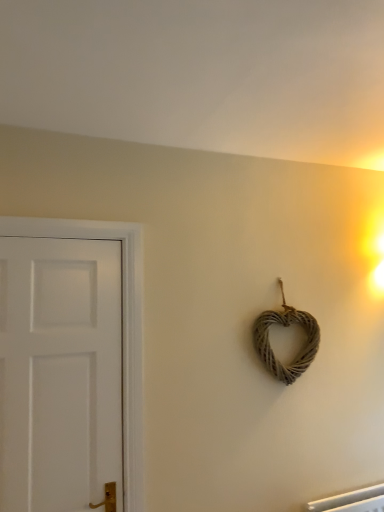
What do you see at coordinates (286, 326) in the screenshot? I see `woven natural heart at center-right` at bounding box center [286, 326].

This screenshot has height=512, width=384. In order to click on woven natural heart at center-right in this screenshot , I will do `click(286, 326)`.

Find the location of a particular element. white matte door at left is located at coordinates (60, 373).

Describe the element at coordinates (60, 373) in the screenshot. I see `white matte door at left` at that location.

At what (x,y) coordinates should I click in order to perform the action: click on woven natural heart at center-right. Please return your answer as a coordinate pair (x, y). Looking at the image, I should click on (286, 326).

Considering the relative positions of woven natural heart at center-right and white matte door at left in the image provided, is woven natural heart at center-right to the right of white matte door at left from the viewer's perspective?

Correct, you'll find woven natural heart at center-right to the right of white matte door at left.

Which object is more forward, woven natural heart at center-right or white matte door at left?

white matte door at left.

Does point (306, 345) come in front of point (16, 338)?

No.

From the image's perspective, is woven natural heart at center-right located above or below white matte door at left?

woven natural heart at center-right is above white matte door at left.

From a real-world perspective, which is physically below, woven natural heart at center-right or white matte door at left?

white matte door at left, from a real-world perspective.

Based on the photo, which of these two, woven natural heart at center-right or white matte door at left, is thinner?

white matte door at left.

Who is taller, woven natural heart at center-right or white matte door at left?

white matte door at left.

Is woven natural heart at center-right bigger or smaller than white matte door at left?

Clearly, woven natural heart at center-right is smaller in size than white matte door at left.

Is woven natural heart at center-right spatially inside white matte door at left, or outside of it?

woven natural heart at center-right is not inside white matte door at left, it's outside.

Is there a large distance between woven natural heart at center-right and white matte door at left?

Actually, woven natural heart at center-right and white matte door at left are a little close together.

Is woven natural heart at center-right oriented away from white matte door at left?

No, white matte door at left is not at the back of woven natural heart at center-right.

How different are the orientations of woven natural heart at center-right and white matte door at left in degrees?

They differ by 0.00972 degrees in their facing directions.

Locate an element on the screen. The image size is (384, 512). door on the left of woven natural heart at center-right is located at coordinates (60, 373).

Can you confirm if white matte door at left is positioned to the right of woven natural heart at center-right?

No, white matte door at left is not to the right of woven natural heart at center-right.

Is white matte door at left closer to camera compared to woven natural heart at center-right?

Yes, white matte door at left is closer to the camera.

Considering the points (106, 318) and (281, 377), which point is in front, point (106, 318) or point (281, 377)?

The point (106, 318) is in front.

From the image's perspective, which is below, white matte door at left or woven natural heart at center-right?

white matte door at left.

From a real-world perspective, is white matte door at left positioned over woven natural heart at center-right based on gravity?

No.

Based on the photo, considering the sizes of objects white matte door at left and woven natural heart at center-right in the image provided, who is thinner, white matte door at left or woven natural heart at center-right?

Thinner between the two is white matte door at left.

Does white matte door at left have a lesser height compared to woven natural heart at center-right?

Incorrect, the height of white matte door at left does not fall short of that of woven natural heart at center-right.

Which of these two, white matte door at left or woven natural heart at center-right, is bigger?

white matte door at left is bigger.

Is white matte door at left located outside woven natural heart at center-right?

Yes, white matte door at left is located beyond the bounds of woven natural heart at center-right.

Is white matte door at left far away from woven natural heart at center-right?

No, there isn't a large distance between white matte door at left and woven natural heart at center-right.

Does white matte door at left turn towards woven natural heart at center-right?

No, white matte door at left is not oriented towards woven natural heart at center-right.

You are a GUI agent. You are given a task and a screenshot of the screen. Output one action in this format:
    pyautogui.click(x=<x>, y=<y>)
    Task: Click on the door on the left side of woven natural heart at center-right
    This screenshot has width=384, height=512.
    Given the screenshot: What is the action you would take?
    pyautogui.click(x=60, y=373)

Identify the location of door located below the woven natural heart at center-right (from the image's perspective). The width and height of the screenshot is (384, 512). (60, 373).

Locate an element on the screen. door in front of the woven natural heart at center-right is located at coordinates (60, 373).